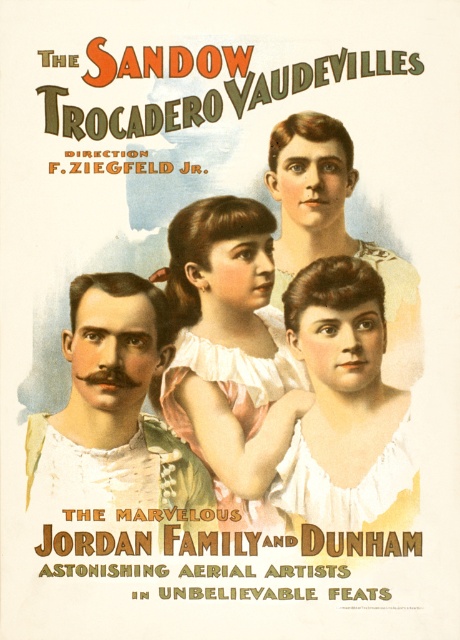
Is mustached man at center smaller than matte white blouse at upper center?

Incorrect, mustached man at center is not smaller in size than matte white blouse at upper center.

Is point (178, 502) more distant than point (308, 112)?

No, it is not.

Image resolution: width=460 pixels, height=640 pixels. I want to click on mustached man at center, so click(120, 406).

Where is `mustached man at center`? mustached man at center is located at coordinates (120, 406).

Does pink satin dress at center appear over matte white blouse at center?

Indeed, pink satin dress at center is positioned over matte white blouse at center.

Can you confirm if pink satin dress at center is taller than matte white blouse at center?

Yes, pink satin dress at center is taller than matte white blouse at center.

Image resolution: width=460 pixels, height=640 pixels. Describe the element at coordinates (225, 346) in the screenshot. I see `pink satin dress at center` at that location.

The image size is (460, 640). Identify the location of pink satin dress at center. (225, 346).

Which is in front, point (90, 422) or point (371, 420)?

Point (371, 420) is more forward.

Does mustached man at center have a greater height compared to matte white blouse at center?

Incorrect, mustached man at center's height is not larger of matte white blouse at center's.

Between point (30, 456) and point (381, 406), which one is positioned behind?

Positioned behind is point (30, 456).

Locate an element on the screen. This screenshot has width=460, height=640. mustached man at center is located at coordinates (120, 406).